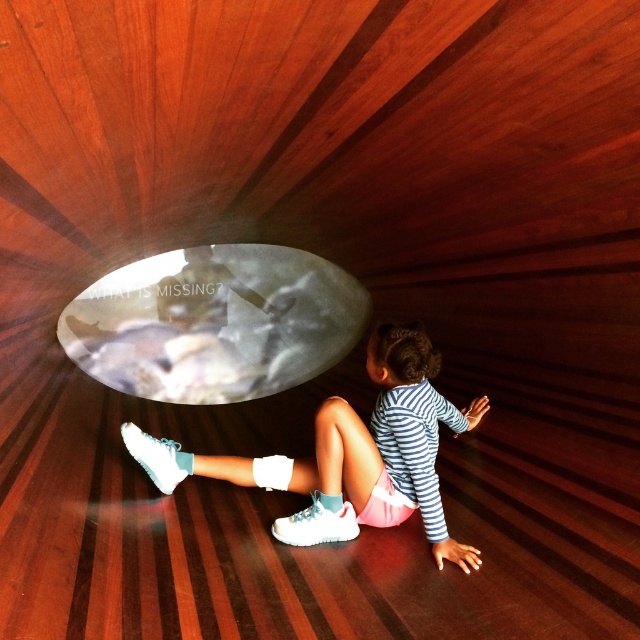
Can you confirm if translucent glass bubble at center is positioned above white matte sneakers at lower center?

Indeed, translucent glass bubble at center is positioned over white matte sneakers at lower center.

Between translucent glass bubble at center and white matte sneakers at lower center, which one is positioned higher?

translucent glass bubble at center

Image resolution: width=640 pixels, height=640 pixels. In order to click on translucent glass bubble at center in this screenshot , I will do `click(214, 323)`.